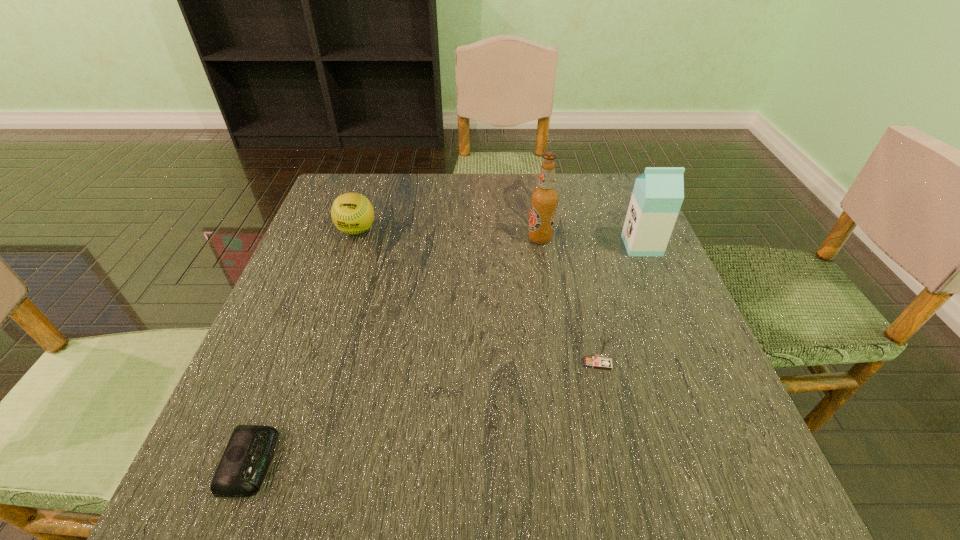
At what (x,y) coordinates should I click in order to perform the action: click on beer bottle. Please return your answer as a coordinate pair (x, y). The image size is (960, 540). Looking at the image, I should click on pos(544,198).

Locate an element on the screen. the rightmost object is located at coordinates (658, 193).

Image resolution: width=960 pixels, height=540 pixels. Identify the location of softball. (352, 213).

Find the location of `the fourth farthest object`. the fourth farthest object is located at coordinates (605, 341).

This screenshot has width=960, height=540. I want to click on the second object from right to left, so click(x=605, y=341).

Where is `the nearest object`? The image size is (960, 540). the nearest object is located at coordinates (240, 473).

I want to click on alarm clock, so click(240, 473).

I want to click on blank area located on the front label of the third object from right to left, so click(x=439, y=238).

The height and width of the screenshot is (540, 960). I want to click on free space located 0.220m on the front label of the third object from right to left, so click(435, 238).

The height and width of the screenshot is (540, 960). What are the coordinates of `vacant space located on the front label of the third object from right to left` in the screenshot? It's located at (447, 238).